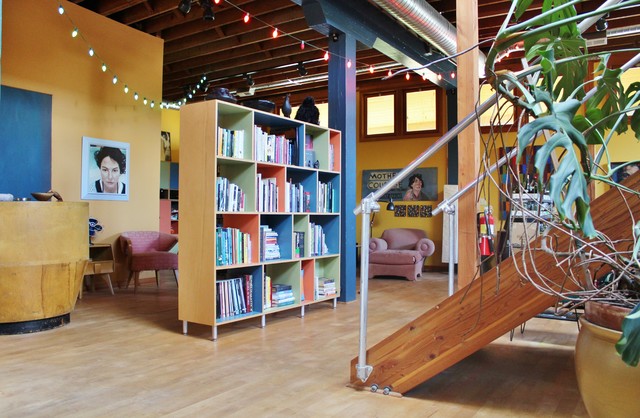
What are the coordinates of `painting` in the screenshot? It's located at (112, 167).